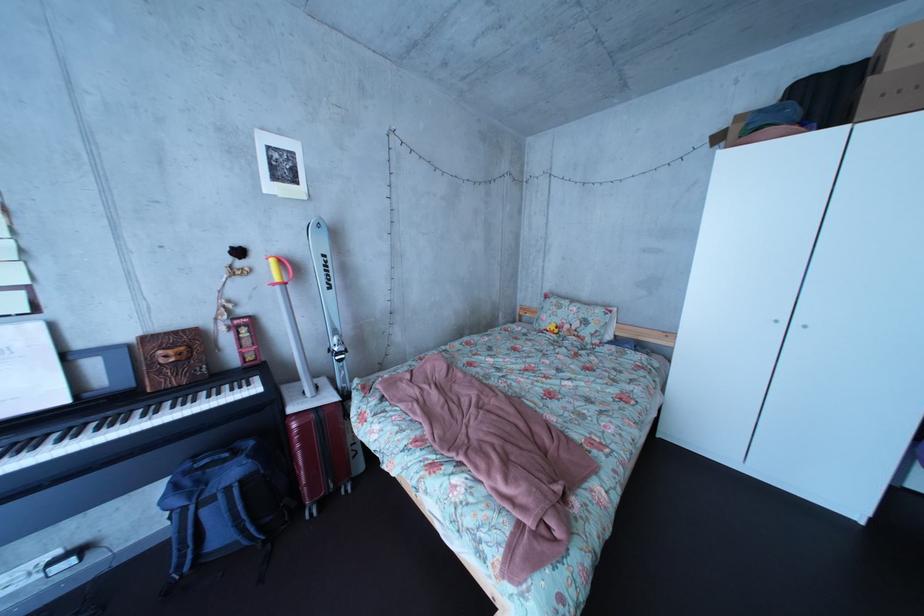
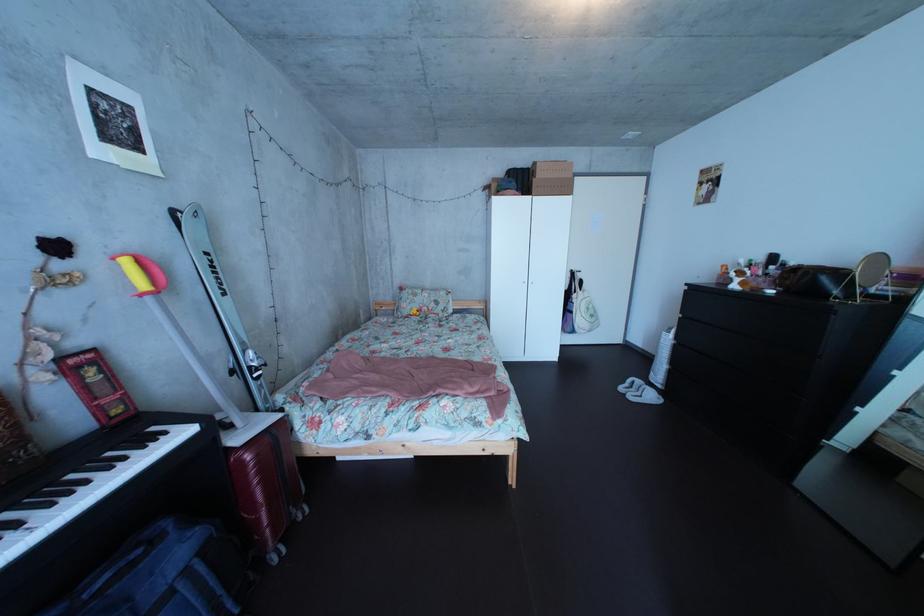
Question: The first image is from the beginning of the video and the second image is from the end. How did the camera likely rotate when shooting the video?

Choices:
 (A) Left
 (B) Right
 (C) Up
 (D) Down

Answer: (B)